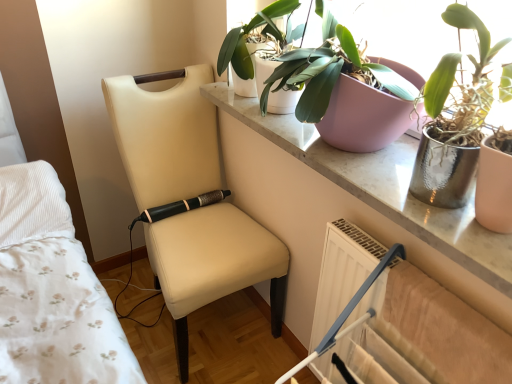
Question: Considering the relative sizes of metallic silver pot at upper right, placed as the second houseplant when sorted from left to right, and green matte plant at upper center, the first houseplant when ordered from left to right, in the image provided, is metallic silver pot at upper right, placed as the second houseplant when sorted from left to right, bigger than green matte plant at upper center, the first houseplant when ordered from left to right,?

Choices:
 (A) no
 (B) yes

Answer: (B)

Question: Does metallic silver pot at upper right, marked as the 2th houseplant in a right-to-left arrangement, appear on the left side of green matte plant at upper center, which is the 3th houseplant in right-to-left order?

Choices:
 (A) yes
 (B) no

Answer: (B)

Question: Considering the relative sizes of metallic silver pot at upper right, placed as the second houseplant when sorted from left to right, and green matte plant at upper center, which is the 3th houseplant in right-to-left order, in the image provided, is metallic silver pot at upper right, placed as the second houseplant when sorted from left to right, shorter than green matte plant at upper center, which is the 3th houseplant in right-to-left order,?

Choices:
 (A) yes
 (B) no

Answer: (B)

Question: From the image's perspective, is metallic silver pot at upper right, marked as the 2th houseplant in a right-to-left arrangement, above green matte plant at upper center, which is the 3th houseplant in right-to-left order?

Choices:
 (A) no
 (B) yes

Answer: (A)

Question: Considering the relative positions of metallic silver pot at upper right, placed as the second houseplant when sorted from left to right, and green matte plant at upper center, which is the 3th houseplant in right-to-left order, in the image provided, is metallic silver pot at upper right, placed as the second houseplant when sorted from left to right, to the right of green matte plant at upper center, which is the 3th houseplant in right-to-left order, from the viewer's perspective?

Choices:
 (A) no
 (B) yes

Answer: (B)

Question: Is metallic silver pot at upper right, acting as the 3th houseplant starting from the left, spatially inside metallic silver pot at upper right, placed as the second houseplant when sorted from left to right, or outside of it?

Choices:
 (A) outside
 (B) inside

Answer: (A)

Question: Is point (443, 145) closer or farther from the camera than point (424, 104)?

Choices:
 (A) farther
 (B) closer

Answer: (B)

Question: In terms of width, does metallic silver pot at upper right, which is the first houseplant from right to left, look wider or thinner when compared to metallic silver pot at upper right, marked as the 2th houseplant in a right-to-left arrangement?

Choices:
 (A) thin
 (B) wide

Answer: (B)

Question: Considering the positions of metallic silver pot at upper right, acting as the 3th houseplant starting from the left, and metallic silver pot at upper right, marked as the 2th houseplant in a right-to-left arrangement, in the image, is metallic silver pot at upper right, acting as the 3th houseplant starting from the left, taller or shorter than metallic silver pot at upper right, marked as the 2th houseplant in a right-to-left arrangement,?

Choices:
 (A) short
 (B) tall

Answer: (B)

Question: From the image's perspective, is metallic silver pot at upper right, acting as the 3th houseplant starting from the left, positioned above or below matte white table at upper right?

Choices:
 (A) below
 (B) above

Answer: (A)

Question: Considering the positions of metallic silver pot at upper right, acting as the 3th houseplant starting from the left, and matte white table at upper right in the image, is metallic silver pot at upper right, acting as the 3th houseplant starting from the left, wider or thinner than matte white table at upper right?

Choices:
 (A) thin
 (B) wide

Answer: (A)

Question: Considering the positions of point (474, 92) and point (382, 190), is point (474, 92) closer or farther from the camera than point (382, 190)?

Choices:
 (A) farther
 (B) closer

Answer: (B)

Question: Is metallic silver pot at upper right, acting as the 3th houseplant starting from the left, taller or shorter than matte white table at upper right?

Choices:
 (A) tall
 (B) short

Answer: (A)

Question: In the image, is green matte plant at upper center, the first houseplant when ordered from left to right, positioned in front of or behind metallic silver pot at upper right, acting as the 3th houseplant starting from the left?

Choices:
 (A) behind
 (B) front

Answer: (A)

Question: In terms of size, does green matte plant at upper center, the first houseplant when ordered from left to right, appear bigger or smaller than metallic silver pot at upper right, acting as the 3th houseplant starting from the left?

Choices:
 (A) big
 (B) small

Answer: (A)